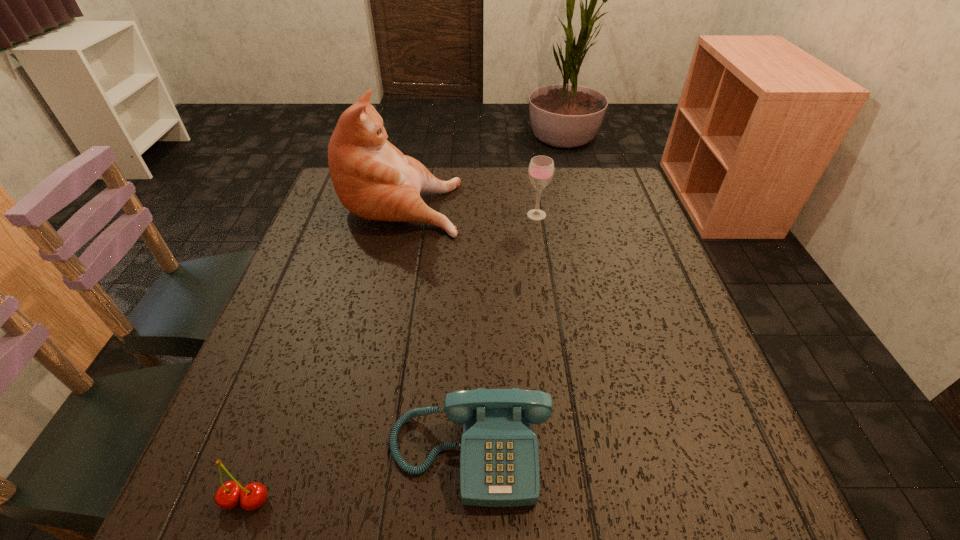
Where is `empty space that is in between the rightmost object and the cherry`? empty space that is in between the rightmost object and the cherry is located at coordinates (392, 357).

Locate an element on the screen. free space between the cat and the rightmost object is located at coordinates (469, 209).

Locate an element on the screen. This screenshot has width=960, height=540. free spot between the second tallest object and the cherry is located at coordinates (392, 357).

Locate an element on the screen. Image resolution: width=960 pixels, height=540 pixels. free area in between the tallest object and the telephone is located at coordinates (436, 327).

At what (x,y) coordinates should I click in order to perform the action: click on free space between the rightmost object and the cherry. Please return your answer as a coordinate pair (x, y). The image size is (960, 540). Looking at the image, I should click on (392, 357).

In order to click on free area in between the tallest object and the rightmost object in this screenshot , I will do `click(469, 209)`.

The width and height of the screenshot is (960, 540). What are the coordinates of `blank region between the telephone and the tallest object` in the screenshot? It's located at (436, 327).

Locate an element on the screen. This screenshot has height=540, width=960. free spot between the cherry and the tallest object is located at coordinates (324, 351).

Image resolution: width=960 pixels, height=540 pixels. What are the coordinates of `unoccupied area between the rightmost object and the tallest object` in the screenshot? It's located at (469, 209).

This screenshot has width=960, height=540. I want to click on the second closest object relative to the cat, so click(499, 460).